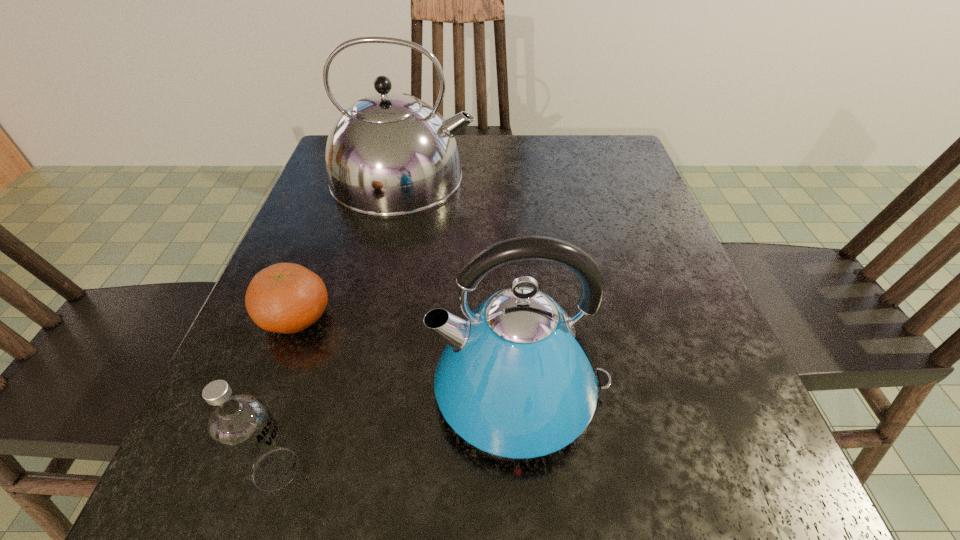
Identify which object is located as the second nearest to the farther kettle. Please provide its 2D coordinates. Your answer should be formatted as a tuple, i.e. [(x, y)], where the tuple contains the x and y coordinates of a point satisfying the conditions above.

[(516, 379)]

Image resolution: width=960 pixels, height=540 pixels. I want to click on object that is the third closest to the third tallest object, so click(389, 154).

The width and height of the screenshot is (960, 540). Find the location of `free space that satisfies the following two spatial constraints: 1. from the spout of the farther kettle; 2. on the front side of the shortest object`. free space that satisfies the following two spatial constraints: 1. from the spout of the farther kettle; 2. on the front side of the shortest object is located at coordinates (372, 318).

In order to click on free space that satisfies the following two spatial constraints: 1. from the spout of the farthest object; 2. on the front side of the shortest object in this screenshot , I will do click(372, 318).